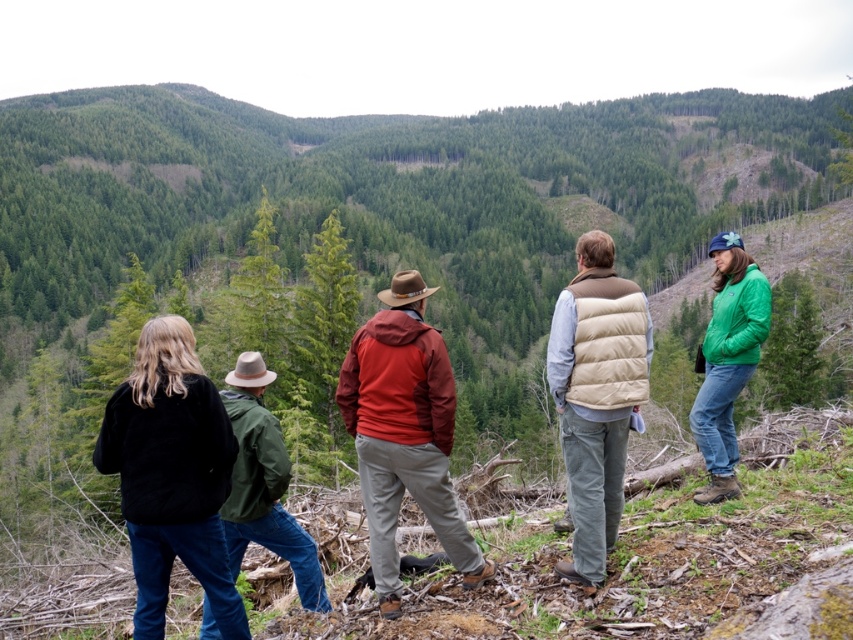
Based on the photo, you are a hiker trying to navigate between two points on the hillside. The first point is at coordinate point (610, 385) and the second is at point (310, 568). If you start at the first point, which direction should you move to reach the second point?

Since point (610, 385) is in front of point (310, 568), you should move backward to reach the second point from the first point.